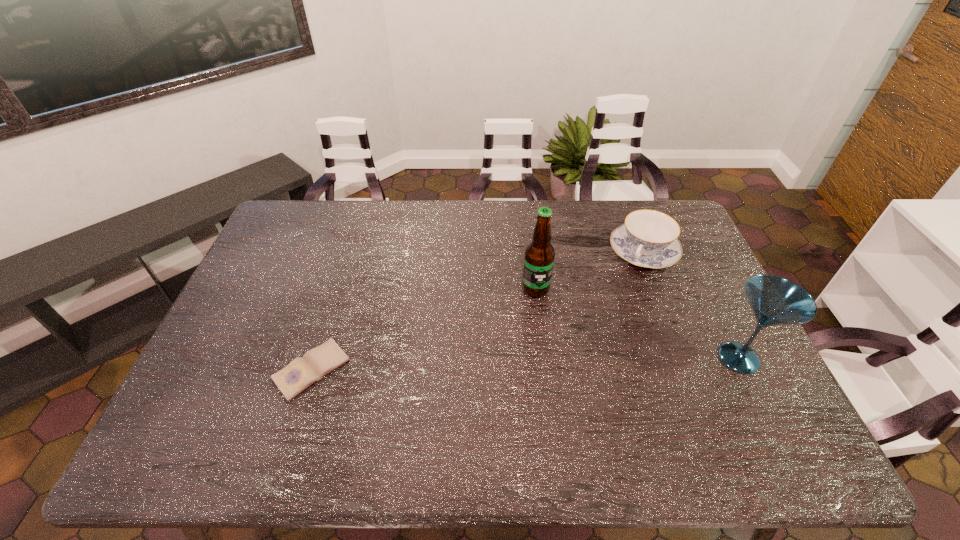
Where is `vacant position located 0.230m with the handle on the side of the chinaware`? The image size is (960, 540). vacant position located 0.230m with the handle on the side of the chinaware is located at coordinates (611, 320).

Where is `free space located 0.360m with the handle on the side of the chinaware`? free space located 0.360m with the handle on the side of the chinaware is located at coordinates (595, 352).

The image size is (960, 540). Find the location of `free spot located on the label of the beer bottle`. free spot located on the label of the beer bottle is located at coordinates (532, 417).

Where is `free space located on the label of the beer bottle`? The height and width of the screenshot is (540, 960). free space located on the label of the beer bottle is located at coordinates (535, 312).

Find the location of a particular element. vacant space located on the label of the beer bottle is located at coordinates (533, 403).

I want to click on object at the far edge, so click(648, 239).

Where is `object that is at the near edge`? object that is at the near edge is located at coordinates (302, 372).

In order to click on martini that is positioned at the right edge in this screenshot , I will do `click(774, 300)`.

Find the location of a particular element. The image size is (960, 540). chinaware at the right edge is located at coordinates (648, 239).

Find the location of a particular element. object at the far right corner is located at coordinates (648, 239).